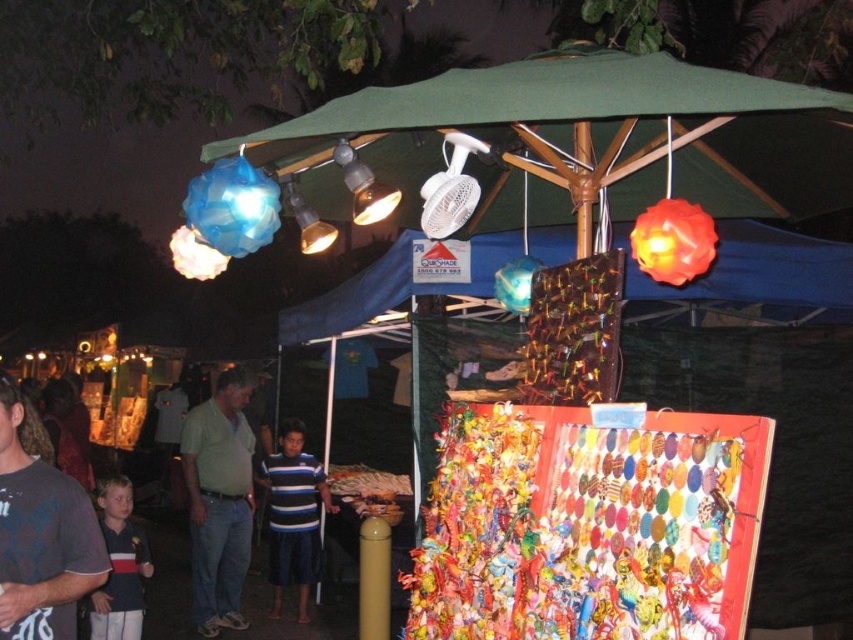
You are a customer at the market and want to buy both the matte gray shirt at center and the blue striped shirt at center. However, you notice that one of them is hidden behind the other. Which shirt is visible on top?

The matte gray shirt at center is visible on top because it is in front of the blue striped shirt at center.

You are a customer at the market and want to pick up the matte gray shirt at center and the green cotton shirt at center. Which one do you need to reach for first to grab both?

You should reach for the matte gray shirt at center first since it is closer to you than the green cotton shirt at center, allowing you to grab both efficiently.